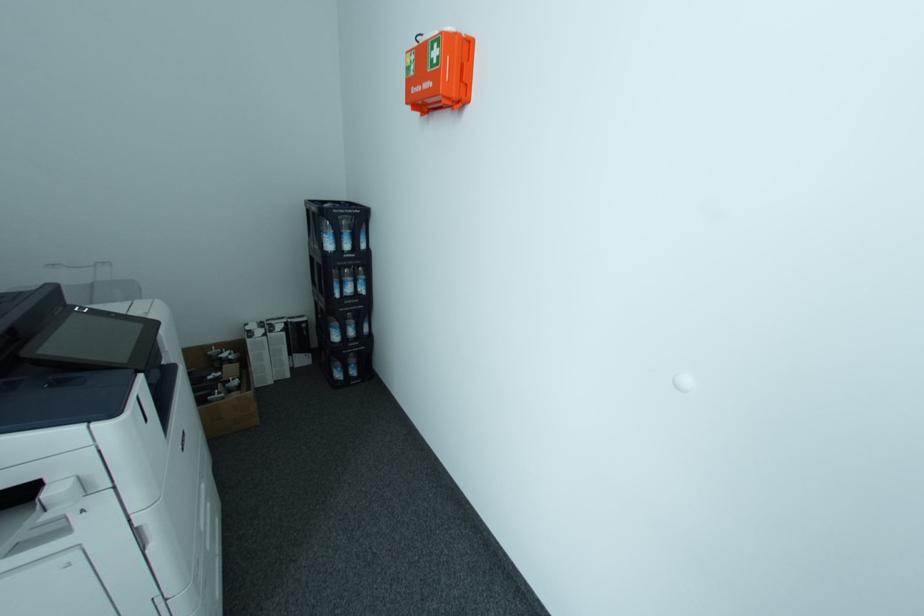
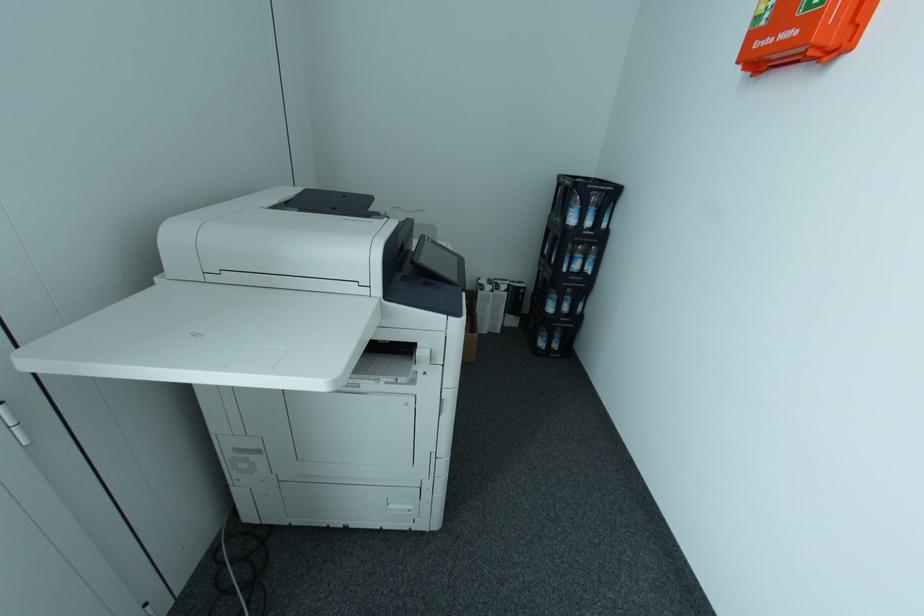
Question: How did the camera likely rotate?

Choices:
 (A) Left
 (B) Right
 (C) Up
 (D) Down

Answer: (A)